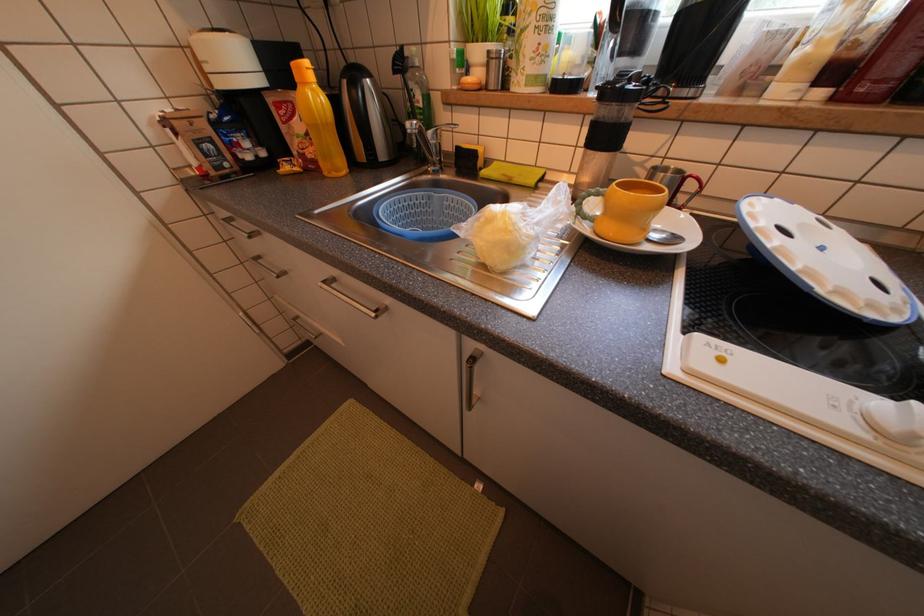
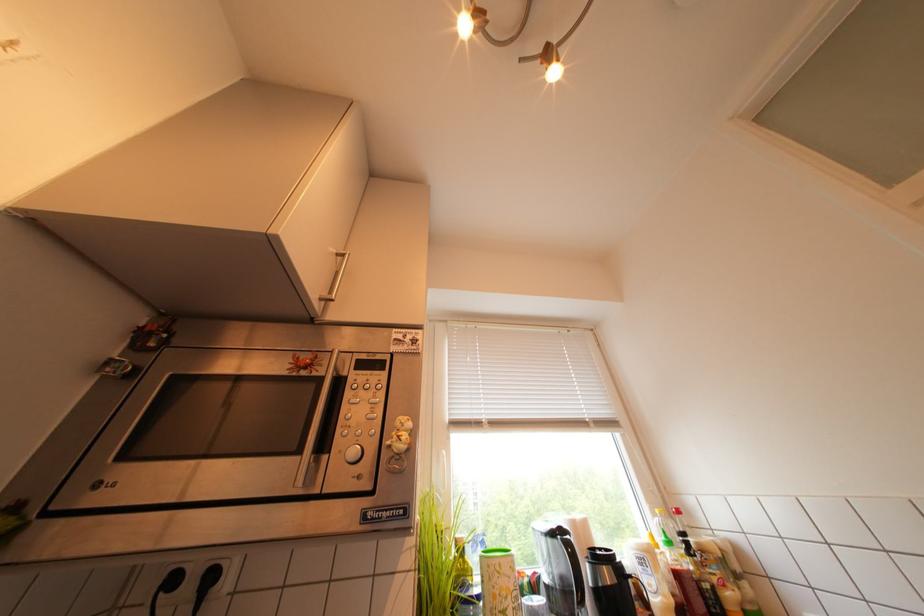
First-person continuous shooting, in which direction is the camera rotating?

The camera rotated toward right-up.